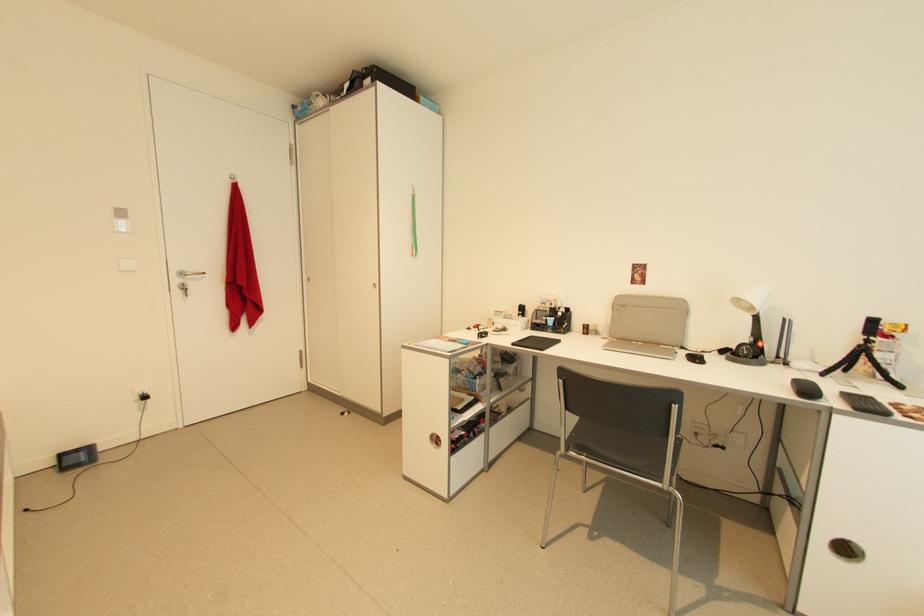
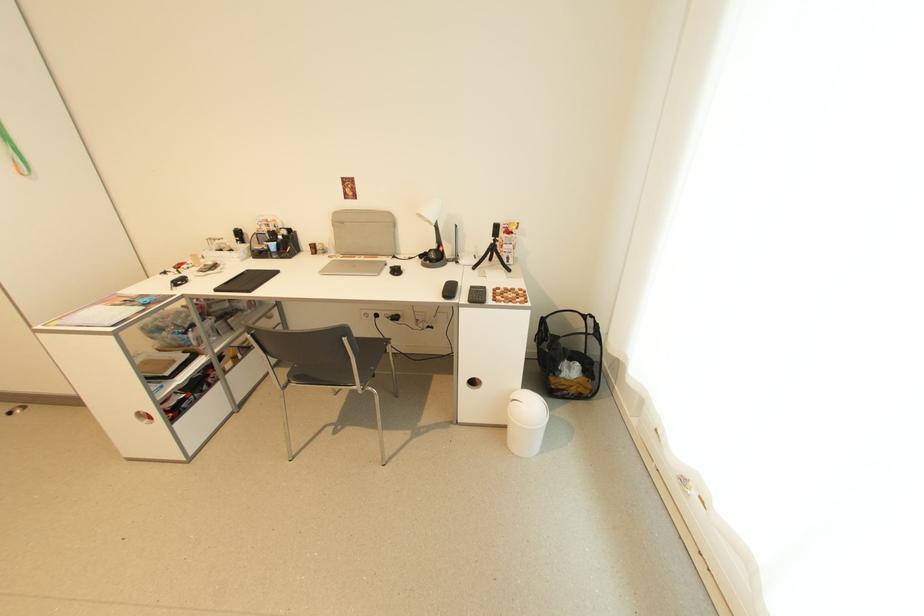
Locate, in the second image, the point that corresponds to (752,342) in the first image.

(439, 248)